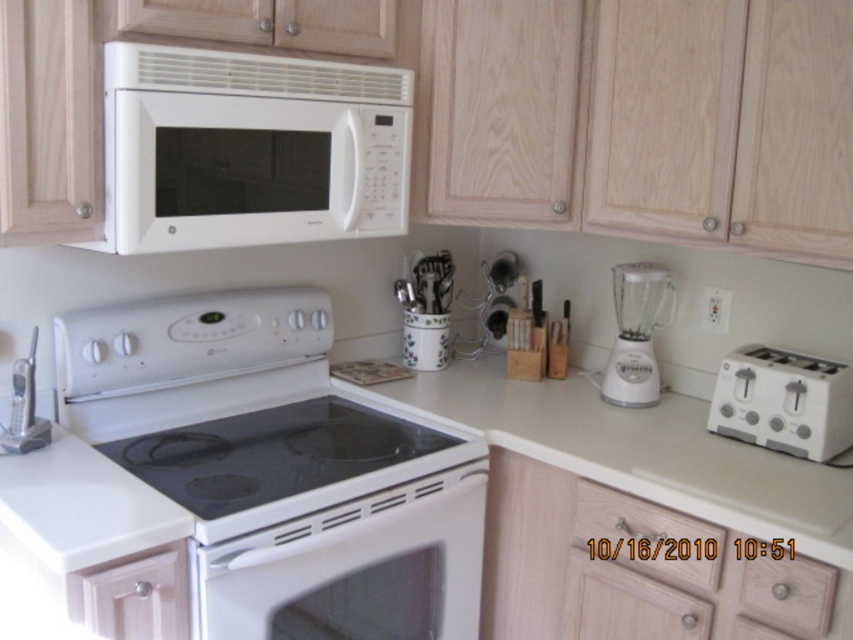
Does white glossy electric stove at center appear over white laminate counter at center?

Actually, white glossy electric stove at center is below white laminate counter at center.

Does white glossy electric stove at center appear under white laminate counter at center?

Yes.

Is point (320, 380) positioned before point (430, 403)?

No, (320, 380) is behind (430, 403).

The image size is (853, 640). I want to click on white glossy electric stove at center, so click(x=279, y=467).

What do you see at coordinates (635, 333) in the screenshot?
I see `white plastic blender at right` at bounding box center [635, 333].

From the picture: Who is lower down, white plastic blender at right or light wood drawer at lower right?

light wood drawer at lower right

Is point (625, 381) positioned before point (831, 572)?

No, (625, 381) is further to viewer.

This screenshot has height=640, width=853. I want to click on white plastic blender at right, so click(x=635, y=333).

Is white glossy electric stove at center positioned before white wood drawer at lower left?

Yes.

Who is positioned more to the right, white glossy electric stove at center or white wood drawer at lower left?

Positioned to the right is white glossy electric stove at center.

Where is `white glossy electric stove at center`? Image resolution: width=853 pixels, height=640 pixels. white glossy electric stove at center is located at coordinates (279, 467).